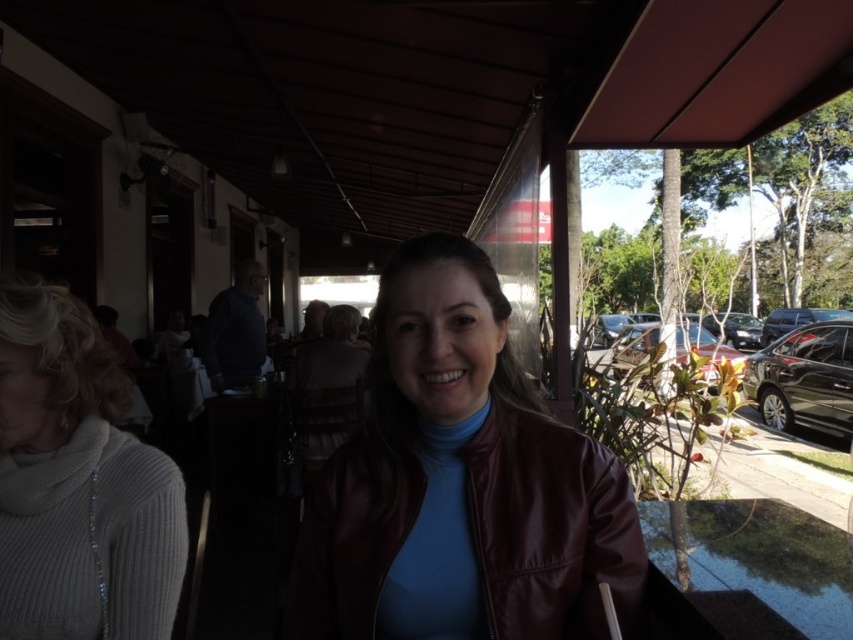
You are a photographer setting up a camera at the center of the scene. You want to ensure both the burgundy leather jacket at center and the white ribbed sweater at left are fully visible in the frame. Given their height difference, which object might require adjusting the camera angle to avoid being cropped out?

The burgundy leather jacket at center is taller than the white ribbed sweater at left, so it might require adjusting the camera angle to avoid being cropped out due to its greater height.